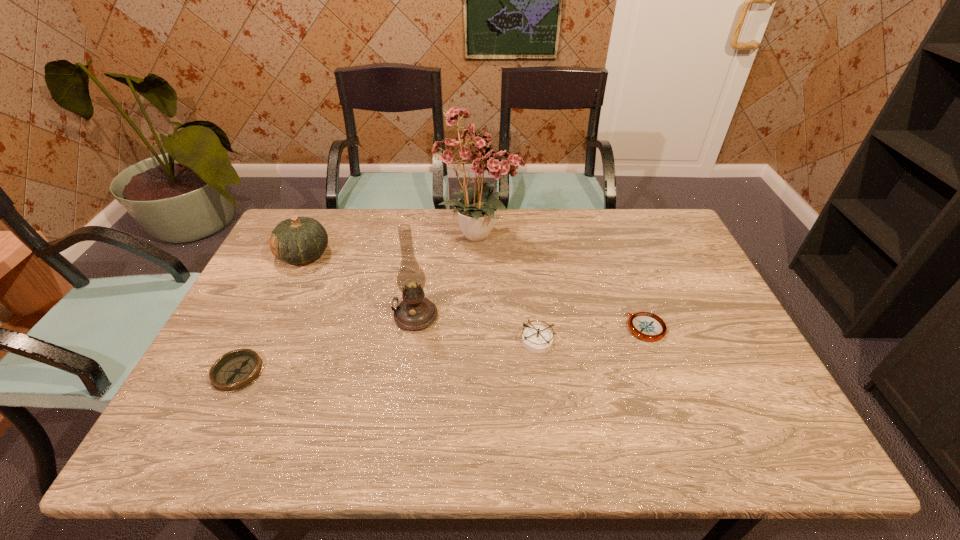
Find the location of `the tallest object`. the tallest object is located at coordinates (475, 155).

Locate an element on the screen. The height and width of the screenshot is (540, 960). oil lamp is located at coordinates coord(415,312).

Identify the location of gourd. This screenshot has height=540, width=960. (298, 240).

Image resolution: width=960 pixels, height=540 pixels. I want to click on the second compass from left to right, so click(538, 339).

You are a GUI agent. You are given a task and a screenshot of the screen. Output one action in this format:
    pyautogui.click(x=<x>, y=<y>)
    Task: Click on the tallest compass
    Image resolution: width=960 pixels, height=540 pixels.
    Given the screenshot: What is the action you would take?
    pyautogui.click(x=538, y=339)

This screenshot has height=540, width=960. What are the coordinates of `the rightmost object` in the screenshot? It's located at (647, 326).

At what (x,y) coordinates should I click in order to perform the action: click on the leftmost compass. Please return your answer as a coordinate pair (x, y). Looking at the image, I should click on (235, 370).

Identify the location of blank space located on the front-facing side of the tallest object. The height and width of the screenshot is (540, 960). (613, 234).

Locate an element on the screen. This screenshot has height=540, width=960. vacant point located 0.200m on the left of the second tallest object is located at coordinates (319, 316).

Where is `vacant space situated 0.110m on the right of the third tallest object`? This screenshot has width=960, height=540. vacant space situated 0.110m on the right of the third tallest object is located at coordinates (366, 255).